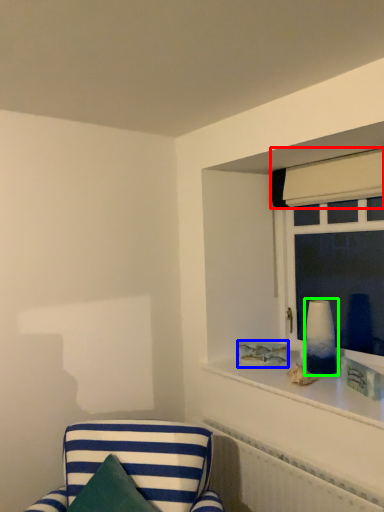
Question: Based on their relative distances, which object is farther from curtain (highlighted by a red box)? Choose from picture frame (highlighted by a blue box) and table lamp (highlighted by a green box).

Choices:
 (A) picture frame
 (B) table lamp

Answer: (A)